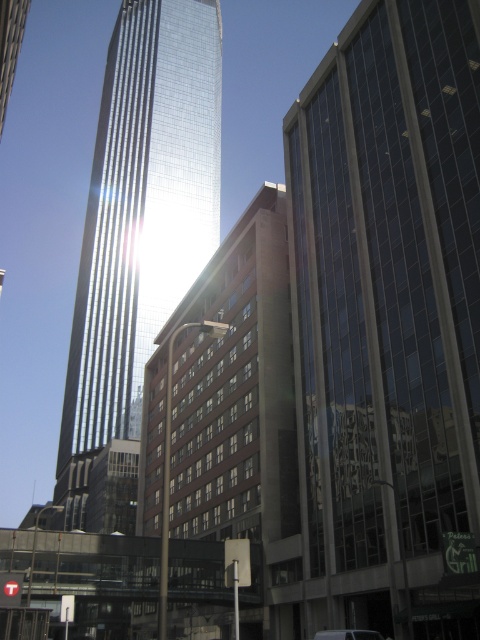
You are a delivery driver who needs to park your metallic silver van at center as close as possible to the glassy reflective skyscraper at center without blocking the entrance. The entrance is located 15 meters away from the van. Can you park the van within the required distance?

The glassy reflective skyscraper at center is 20.25 meters away from the metallic silver van at center. Since the entrance is 15 meters away from the van, parking at the current distance would exceed the required limit. You need to move the van closer to reduce the distance to 15 meters or less.

You are a delivery driver approaching the city center and see the glassy reflective skyscraper at center and the metallic silver van at center. Which object is closer to you as you drive towards the city?

The glassy reflective skyscraper at center is closer to you because it is in front of the metallic silver van at center, meaning the skyscraper is blocking the view of the van from your perspective.